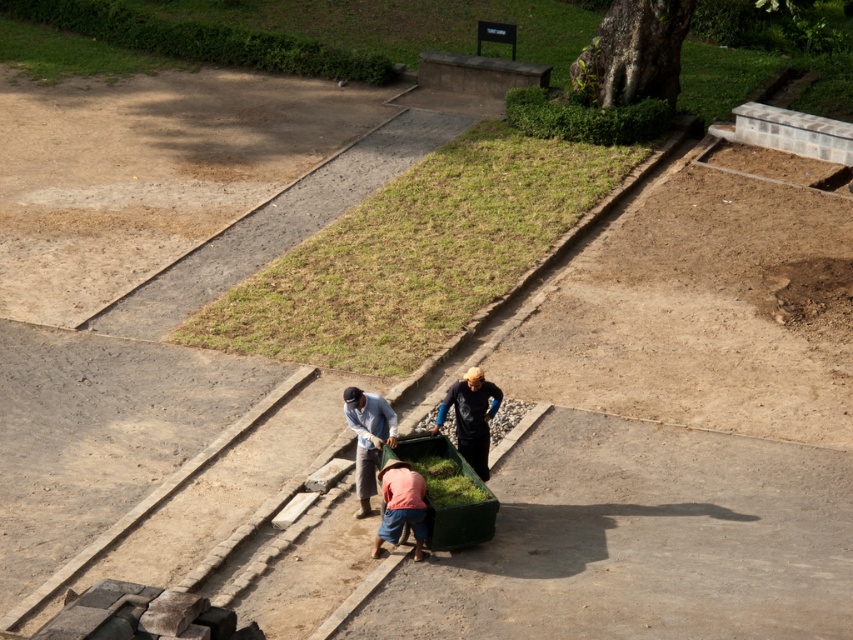
You are a visitor at the garden and see the green matte cart at center and the light blue denim shirt at center. Which object is closer to the ground?

The green matte cart at center is positioned under the light blue denim shirt at center, so the green matte cart at center is closer to the ground.

Based on the scene description, where is the black matte shirt at center located in terms of coordinates?

The black matte shirt at center is located at coordinates point (471, 417).

You are standing at the point with coordinates point (392, 540) and want to move towards the point with coordinates point (476, 426). Which direction should you move to get closer to your destination?

You should move towards the point (476, 426), which is closer to you than point (392, 540), so moving forward would bring you closer.